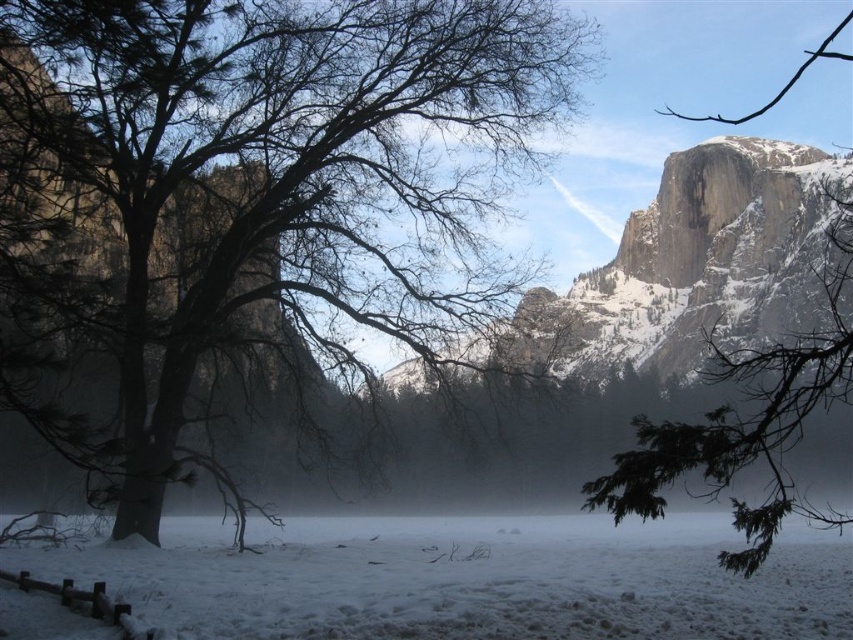
You are standing at the point with coordinates point (792, 362) and want to walk towards the point with coordinates point (590, 582). Will the wooden fence in the bottom left corner block your path?

Point (590, 582) is behind point (792, 362), so the wooden fence in the bottom left corner will not block your path.